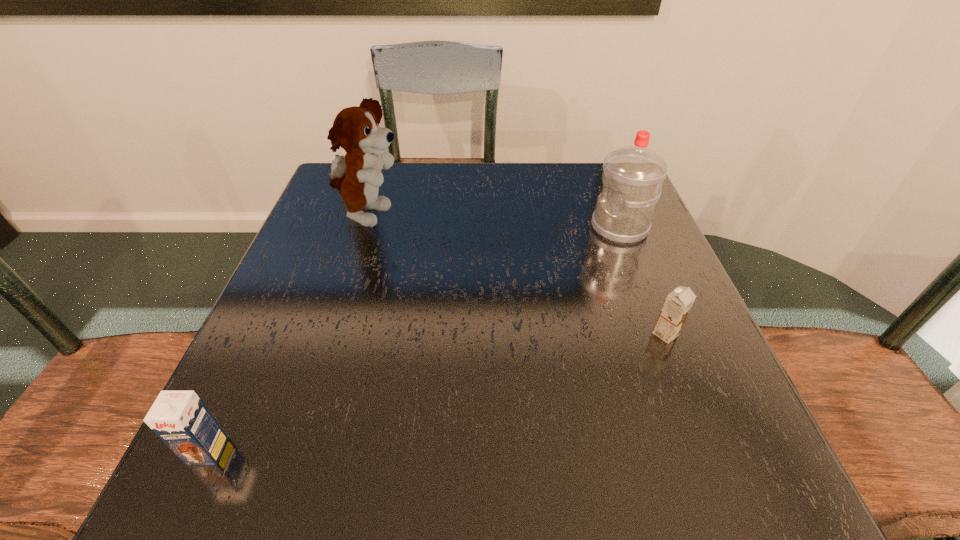
Image resolution: width=960 pixels, height=540 pixels. I want to click on object located at the far right corner, so click(632, 177).

What are the coordinates of `free location at the far edge` in the screenshot? It's located at (523, 211).

You are a GUI agent. You are given a task and a screenshot of the screen. Output one action in this format:
    pyautogui.click(x=<x>, y=<y>)
    Task: Click on the vacant region at the near edge
    This screenshot has width=960, height=540.
    Given the screenshot: What is the action you would take?
    pyautogui.click(x=612, y=506)

The width and height of the screenshot is (960, 540). Identify the location of vacant position at the left edge of the desktop. (289, 305).

Locate an element on the screen. This screenshot has height=540, width=960. free space at the right edge is located at coordinates (660, 379).

Find the location of a particular element. The width and height of the screenshot is (960, 540). vacant space at the far right corner of the desktop is located at coordinates (589, 190).

In the image, there is a desktop. Where is `vacant area at the near right corner`? The width and height of the screenshot is (960, 540). vacant area at the near right corner is located at coordinates (745, 446).

Find the location of a particular element. The height and width of the screenshot is (540, 960). vacant area between the third shortest object and the third object from right to left is located at coordinates 494,222.

The width and height of the screenshot is (960, 540). Identify the location of vacant area that lies between the shortest object and the puppy. (517, 275).

Locate an element on the screen. The image size is (960, 540). vacant area between the nearer chocolate milk and the water bottle is located at coordinates (414, 339).